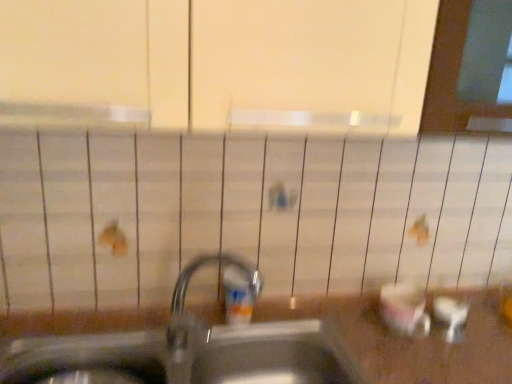
Question: From a real-world perspective, is metallic sink at center physically located above or below translucent plastic soap dispenser at center?

Choices:
 (A) below
 (B) above

Answer: (A)

Question: In terms of width, does metallic sink at center look wider or thinner when compared to translucent plastic soap dispenser at center?

Choices:
 (A) thin
 (B) wide

Answer: (B)

Question: From their relative heights in the image, would you say metallic sink at center is taller or shorter than translucent plastic soap dispenser at center?

Choices:
 (A) tall
 (B) short

Answer: (A)

Question: Is translucent plastic soap dispenser at center in front of or behind metallic sink at center in the image?

Choices:
 (A) front
 (B) behind

Answer: (B)

Question: Visually, is translucent plastic soap dispenser at center positioned to the left or to the right of metallic sink at center?

Choices:
 (A) right
 (B) left

Answer: (A)

Question: Considering the positions of translucent plastic soap dispenser at center and metallic sink at center in the image, is translucent plastic soap dispenser at center taller or shorter than metallic sink at center?

Choices:
 (A) short
 (B) tall

Answer: (A)

Question: Is translucent plastic soap dispenser at center wider or thinner than metallic sink at center?

Choices:
 (A) thin
 (B) wide

Answer: (A)